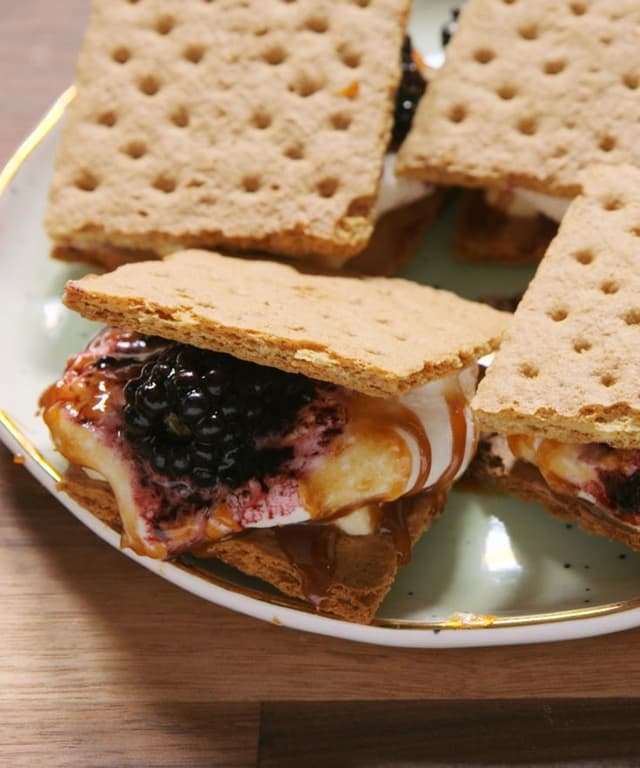
The height and width of the screenshot is (768, 640). What are the coordinates of `wooden table` in the screenshot? It's located at (92, 643), (489, 722), (29, 84).